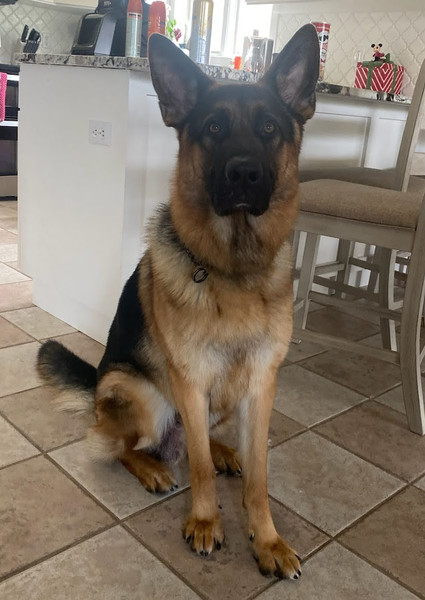
In order to click on counter top in this screenshot , I will do `click(109, 61)`.